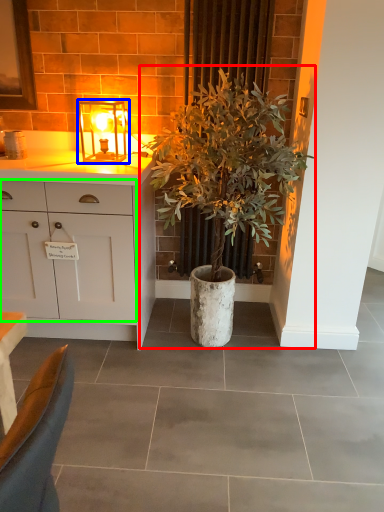
Question: Considering the real-world distances, which object is farthest from houseplant (highlighted by a red box)? lamp (highlighted by a blue box) or cabinetry (highlighted by a green box)?

Choices:
 (A) lamp
 (B) cabinetry

Answer: (A)